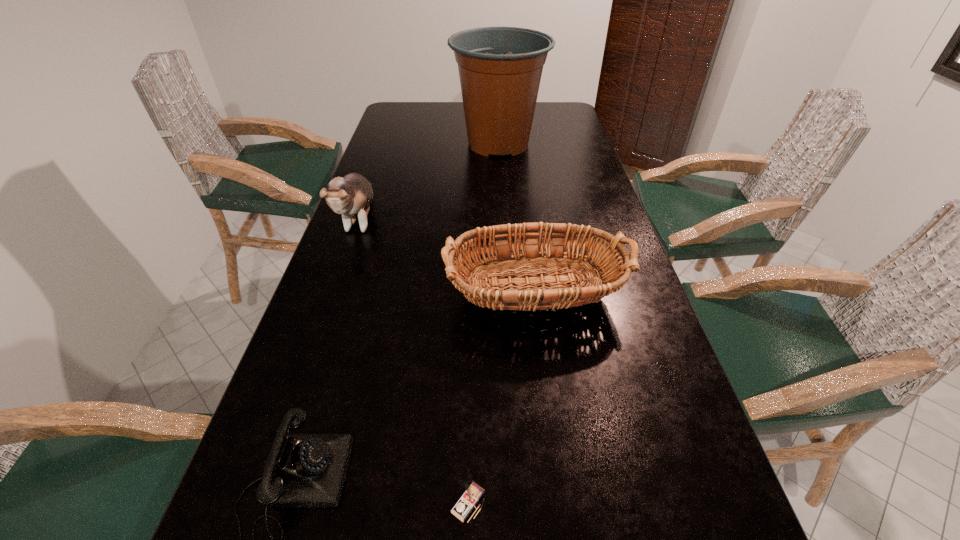
The width and height of the screenshot is (960, 540). I want to click on the farthest object, so click(500, 68).

I want to click on flowerpot, so click(x=500, y=68).

What are the coordinates of `cat` in the screenshot? It's located at (351, 195).

Identify the location of basket. (608, 270).

The image size is (960, 540). Find the location of `matchbox`. matchbox is located at coordinates (471, 492).

The height and width of the screenshot is (540, 960). Identify the location of free space located on the back of the farthest object. (495, 107).

Identify the location of vacant region located at the face of the cat. This screenshot has width=960, height=540. (324, 320).

Identify the location of free space located 0.190m on the back of the basket. (521, 209).

Locate an element on the screen. Image resolution: width=960 pixels, height=540 pixels. free space located 0.370m on the right of the matchbox is located at coordinates (728, 503).

Find the location of a particular element. object located in the far edge section of the desktop is located at coordinates (500, 68).